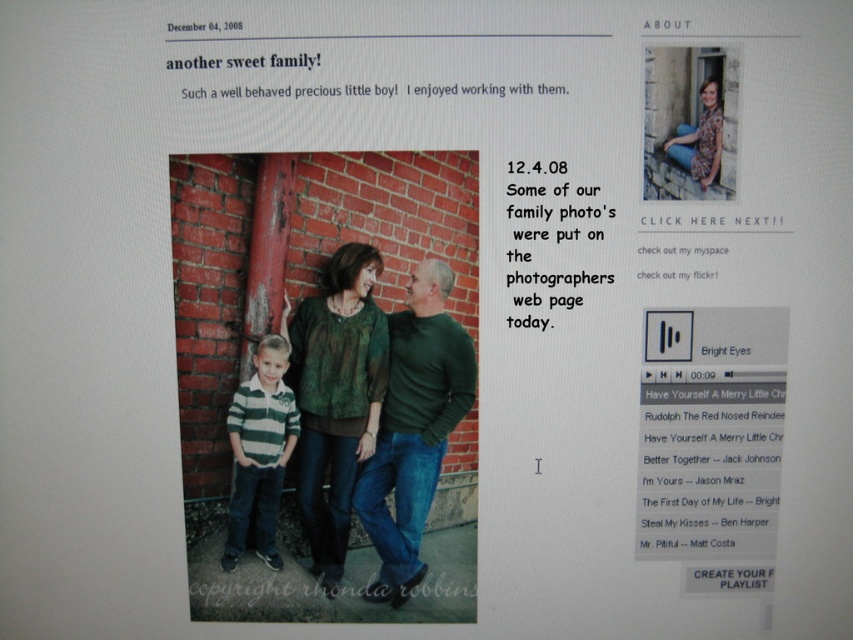
You are a graphic designer working on a photo editing project. You need to place a watermark on the image. The watermark should be placed above the highest object between the green textured blouse at center and the floral shirt at upper right. Where should you place the watermark?

The green textured blouse at center is positioned under the floral shirt at upper right, so the watermark should be placed above the floral shirt at upper right since it is higher than the green textured blouse at center.